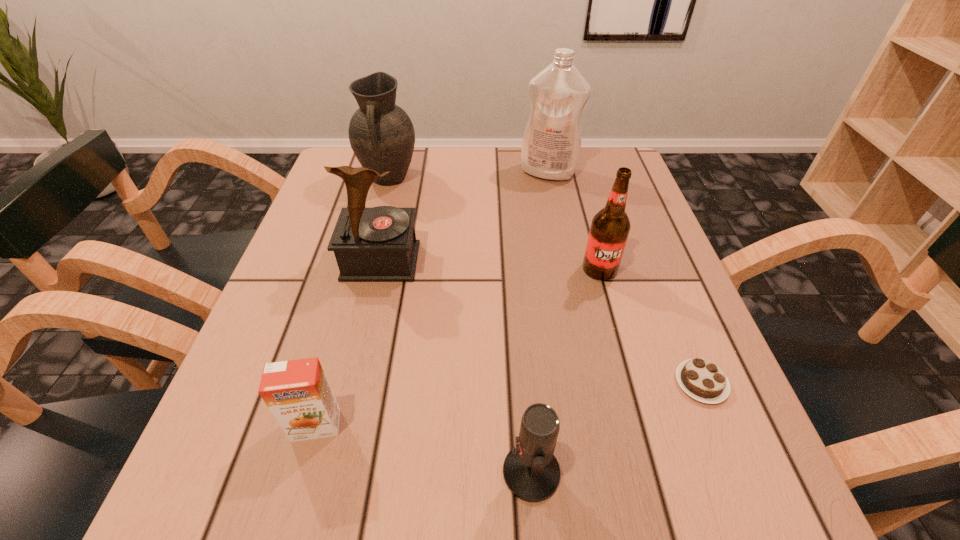
Identify the location of vacant space positioned at the horn opening of the phonograph_record. (371, 306).

The height and width of the screenshot is (540, 960). Identify the location of vacant space situated 0.310m on the left of the root beer. (429, 269).

This screenshot has height=540, width=960. Identify the location of free space located 0.220m on the side of the nearest object with the red ring. pos(344,472).

This screenshot has height=540, width=960. What are the coordinates of `vacant position located on the side of the nearest object with the red ring` in the screenshot? It's located at [307, 472].

Where is `free region located 0.280m on the side of the nearest object with the red ring`? This screenshot has height=540, width=960. free region located 0.280m on the side of the nearest object with the red ring is located at coordinates (300, 472).

Locate an element on the screen. The height and width of the screenshot is (540, 960). vacant area located on the back of the orange juice is located at coordinates (353, 291).

Where is `free region located on the back of the chocolate cake`? free region located on the back of the chocolate cake is located at coordinates (638, 227).

Locate an element on the screen. detergent that is at the far edge is located at coordinates (551, 145).

I want to click on pitcher located in the far edge section of the desktop, so click(381, 134).

Where is `object located at the near edge`? Image resolution: width=960 pixels, height=540 pixels. object located at the near edge is located at coordinates (531, 472).